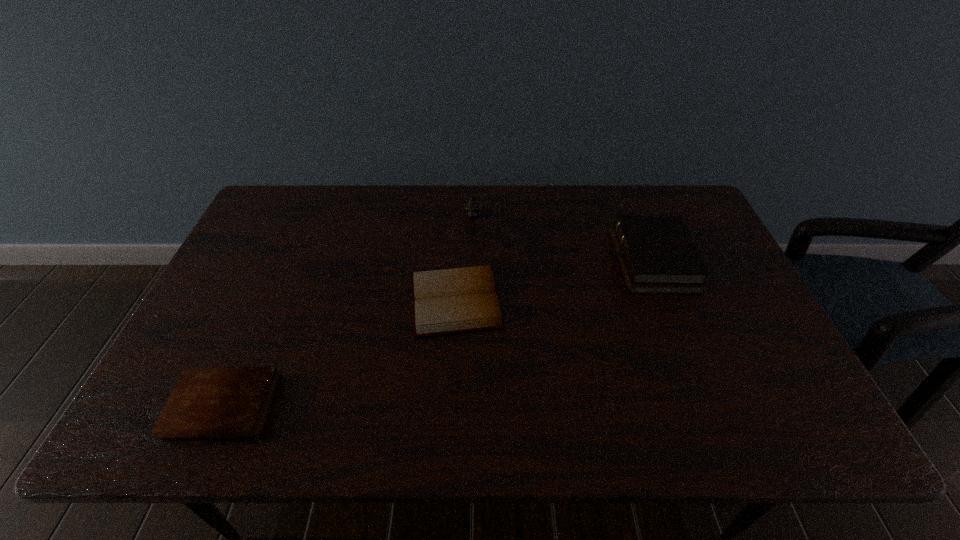
Where is `free region located 0.230m on the spine side of the rightmost object`? The width and height of the screenshot is (960, 540). free region located 0.230m on the spine side of the rightmost object is located at coordinates (539, 261).

Identify the location of free space located 0.080m on the left of the second Bible from left to right. (379, 300).

Where is `object located at the far edge`? The width and height of the screenshot is (960, 540). object located at the far edge is located at coordinates (472, 206).

Locate an element on the screen. object positioned at the near edge is located at coordinates (207, 402).

Find the location of `object present at the left edge`. object present at the left edge is located at coordinates (207, 402).

I want to click on object present at the right edge, so click(x=657, y=255).

Find the location of `object present at the near left corner`. object present at the near left corner is located at coordinates (207, 402).

The width and height of the screenshot is (960, 540). What are the coordinates of `free region at the far edge of the desktop` in the screenshot? It's located at pyautogui.click(x=417, y=194).

What are the coordinates of `free region at the near edge of the desktop` in the screenshot? It's located at (289, 443).

Locate an element on the screen. The height and width of the screenshot is (540, 960). free location at the left edge of the desktop is located at coordinates (266, 309).